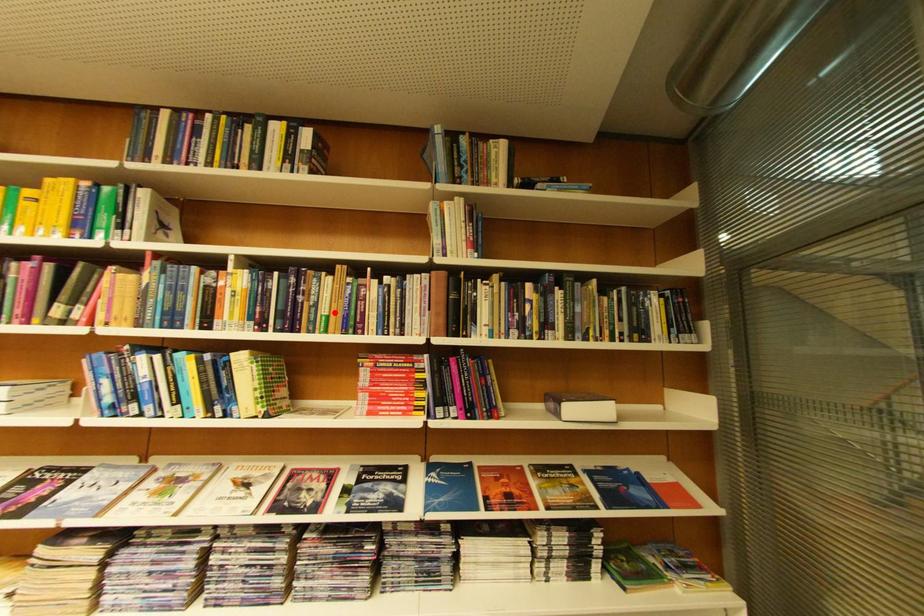
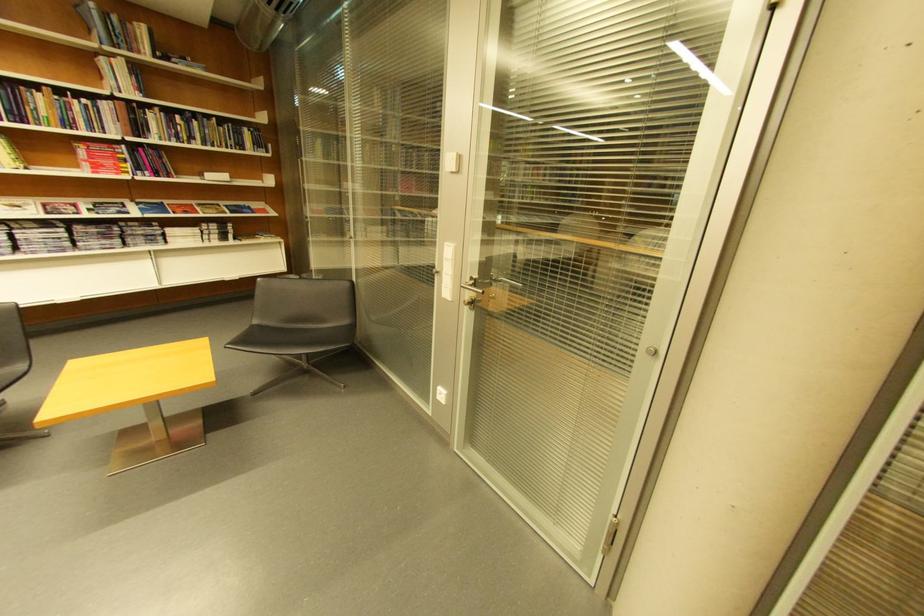
Find the pixel in the second image that matches the highlighted location in the first image.

(54, 116)